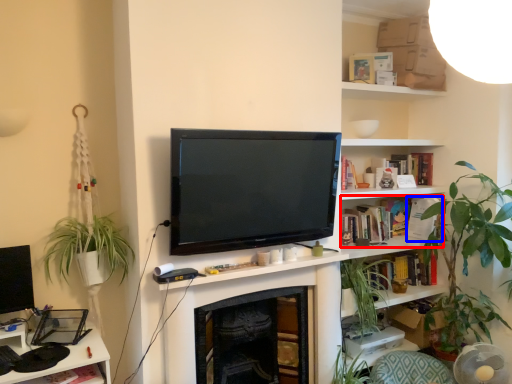
Question: Which object appears closest to the camera in this image, book (highlighted by a red box) or book (highlighted by a blue box)?

Choices:
 (A) book
 (B) book

Answer: (A)